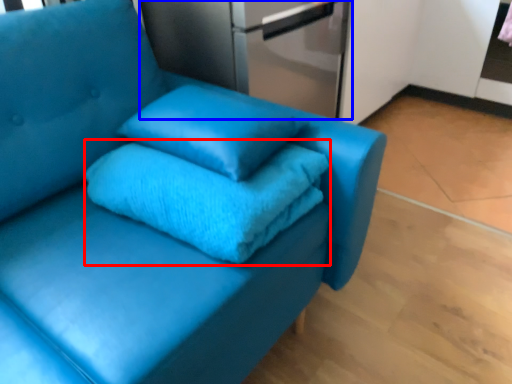
Question: Among these objects, which one is farthest to the camera, bath towel (highlighted by a red box) or appliance (highlighted by a blue box)?

Choices:
 (A) bath towel
 (B) appliance

Answer: (B)